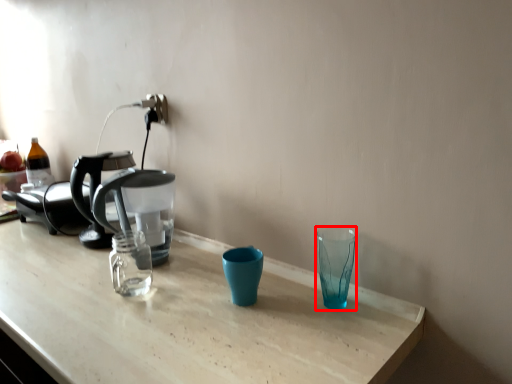
Question: Considering the relative positions of shot glass (annotated by the red box) and coffee maker in the image provided, where is shot glass (annotated by the red box) located with respect to the staircase?

Choices:
 (A) left
 (B) right

Answer: (B)